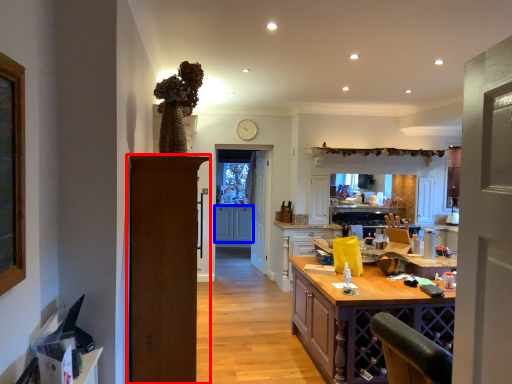
Question: Among these objects, which one is nearest to the camera, door (highlighted by a red box) or cabinetry (highlighted by a blue box)?

Choices:
 (A) door
 (B) cabinetry

Answer: (A)